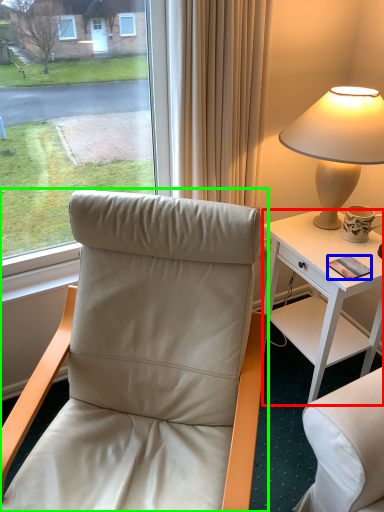
Question: Which object is the farthest from desk (highlighted by a red box)? Choose among these: mobile phone (highlighted by a blue box) or chair (highlighted by a green box).

Choices:
 (A) mobile phone
 (B) chair

Answer: (B)